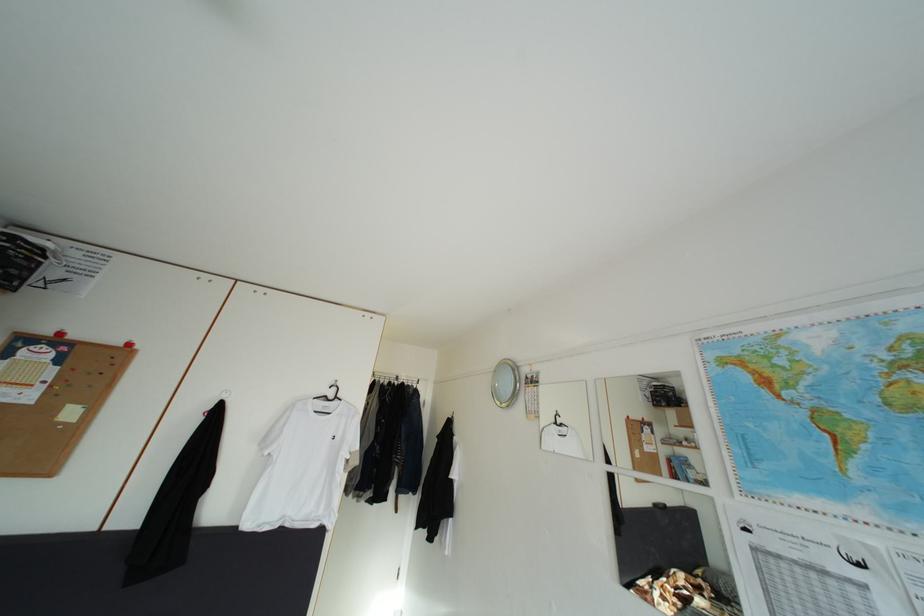
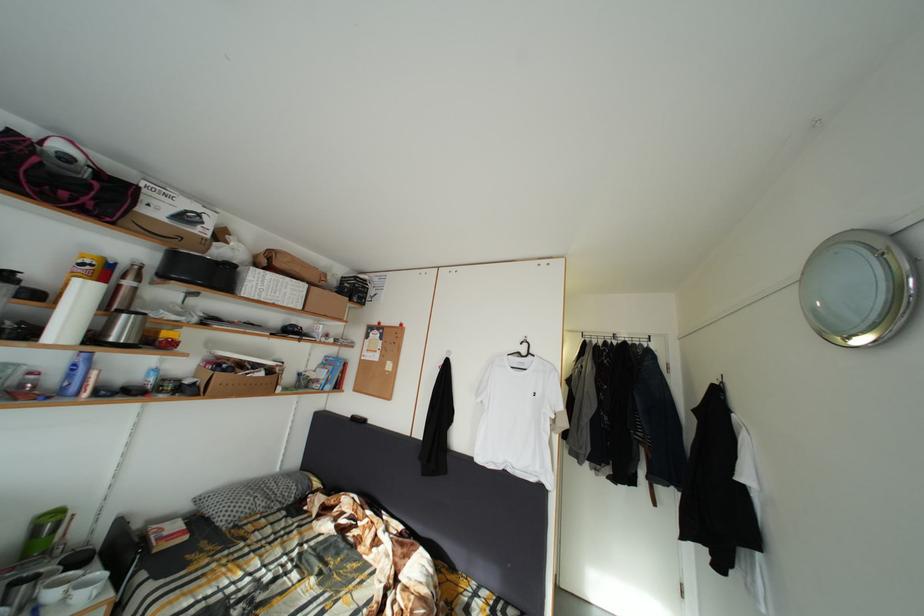
Question: The camera is either moving clockwise (left) or counter-clockwise (right) around the object. The first image is from the beginning of the video and the second image is from the end. Is the camera moving left or right when shooting the video?

Choices:
 (A) Left
 (B) Right

Answer: (B)